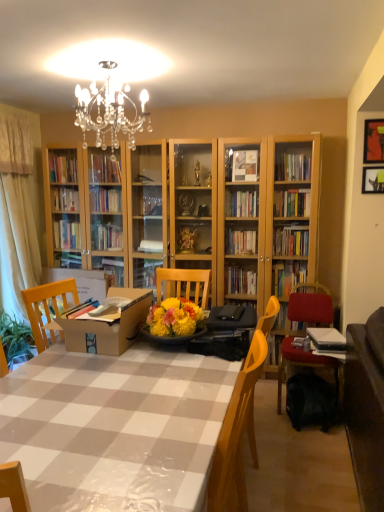
Identify the location of white glossy table at center. This screenshot has height=512, width=384. (115, 426).

In order to face black fabric backpack at lower right, should I rotate leftwards or rightwards?

To face it directly, rotate right by 15.805 degrees.

The image size is (384, 512). I want to click on beige fabric curtain at left, so click(x=17, y=216).

From the image's perspective, between white glossy table at center and brown cardboard box at center, who is located below?

From the image's view, white glossy table at center is below.

Looking at their sizes, would you say white glossy table at center is wider or thinner than brown cardboard box at center?

In the image, white glossy table at center appears to be wider than brown cardboard box at center.

From their relative heights in the image, would you say white glossy table at center is taller or shorter than brown cardboard box at center?

white glossy table at center is taller than brown cardboard box at center.

Are white glossy table at center and brown cardboard box at center far apart?

They are positioned close to each other.

Which of these two, velvet red chair at right or metallic silver picture frame at upper right, placed as the second picture frame when sorted from top to bottom, stands shorter?

metallic silver picture frame at upper right, placed as the second picture frame when sorted from top to bottom, is shorter.

Considering the sizes of velvet red chair at right and metallic silver picture frame at upper right, which ranks as the 1th picture frame in bottom-to-top order, in the image, is velvet red chair at right bigger or smaller than metallic silver picture frame at upper right, which ranks as the 1th picture frame in bottom-to-top order,?

In the image, velvet red chair at right appears to be larger than metallic silver picture frame at upper right, which ranks as the 1th picture frame in bottom-to-top order.

Would you say velvet red chair at right is to the left or to the right of metallic silver picture frame at upper right, placed as the second picture frame when sorted from top to bottom, in the picture?

Based on their positions, velvet red chair at right is located to the left of metallic silver picture frame at upper right, placed as the second picture frame when sorted from top to bottom.

From a real-world perspective, is velvet red chair at right located higher than metallic silver picture frame at upper right, placed as the second picture frame when sorted from top to bottom?

Actually, velvet red chair at right is physically below metallic silver picture frame at upper right, placed as the second picture frame when sorted from top to bottom, in the real world.

How many degrees apart are the facing directions of brown cardboard box at center and metallic silver picture frame at upper right, placed as the second picture frame when sorted from top to bottom?

They differ by 1.79 degrees in their facing directions.

There is a brown cardboard box at center. At what (x,y) coordinates should I click in order to perform the action: click on the 1st picture frame above it (from the image's perspective). Please return your answer as a coordinate pair (x, y). Looking at the image, I should click on (373, 180).

Is point (104, 353) closer to camera compared to point (370, 169)?

Yes, point (104, 353) is in front of point (370, 169).

Consider the image. Does brown cardboard box at center touch metallic gold picture frame at upper right, the 1th picture frame viewed from the top?

No, brown cardboard box at center is not next to metallic gold picture frame at upper right, the 1th picture frame viewed from the top.

Based on the photo, does brown cardboard box at center lie in front of metallic gold picture frame at upper right, which is counted as the second picture frame, starting from the bottom?

Yes, the depth of brown cardboard box at center is less than that of metallic gold picture frame at upper right, which is counted as the second picture frame, starting from the bottom.

Would you say brown cardboard box at center is to the left or to the right of metallic gold picture frame at upper right, the 1th picture frame viewed from the top, in the picture?

Based on their positions, brown cardboard box at center is located to the left of metallic gold picture frame at upper right, the 1th picture frame viewed from the top.

Does metallic silver picture frame at upper right, placed as the second picture frame when sorted from top to bottom, have a greater width compared to metallic gold picture frame at upper right, which is counted as the second picture frame, starting from the bottom?

No, metallic silver picture frame at upper right, placed as the second picture frame when sorted from top to bottom, is not wider than metallic gold picture frame at upper right, which is counted as the second picture frame, starting from the bottom.

Looking at the image, does metallic silver picture frame at upper right, placed as the second picture frame when sorted from top to bottom, seem bigger or smaller compared to metallic gold picture frame at upper right, which is counted as the second picture frame, starting from the bottom?

metallic silver picture frame at upper right, placed as the second picture frame when sorted from top to bottom, is smaller than metallic gold picture frame at upper right, which is counted as the second picture frame, starting from the bottom.

Can you tell me how much metallic silver picture frame at upper right, which ranks as the 1th picture frame in bottom-to-top order, and metallic gold picture frame at upper right, the 1th picture frame viewed from the top, differ in facing direction?

The angular difference between metallic silver picture frame at upper right, which ranks as the 1th picture frame in bottom-to-top order, and metallic gold picture frame at upper right, the 1th picture frame viewed from the top, is 0.0364 degrees.

Which is more to the right, metallic silver picture frame at upper right, placed as the second picture frame when sorted from top to bottom, or metallic gold picture frame at upper right, which is counted as the second picture frame, starting from the bottom?

metallic silver picture frame at upper right, placed as the second picture frame when sorted from top to bottom, is more to the right.

From a real-world perspective, is metallic gold picture frame at upper right, the 1th picture frame viewed from the top, above or below white glossy table at center?

metallic gold picture frame at upper right, the 1th picture frame viewed from the top, is situated higher than white glossy table at center in the real world.

Is point (366, 123) closer to viewer compared to point (186, 483)?

No, it is behind (186, 483).

Considering the relative sizes of metallic gold picture frame at upper right, the 1th picture frame viewed from the top, and white glossy table at center in the image provided, is metallic gold picture frame at upper right, the 1th picture frame viewed from the top, bigger than white glossy table at center?

No, metallic gold picture frame at upper right, the 1th picture frame viewed from the top, is not bigger than white glossy table at center.

Does metallic gold picture frame at upper right, the 1th picture frame viewed from the top, appear on the right side of white glossy table at center?

Indeed, metallic gold picture frame at upper right, the 1th picture frame viewed from the top, is positioned on the right side of white glossy table at center.

Considering the sizes of objects metallic silver picture frame at upper right, which ranks as the 1th picture frame in bottom-to-top order, and beige fabric curtain at left in the image provided, who is thinner, metallic silver picture frame at upper right, which ranks as the 1th picture frame in bottom-to-top order, or beige fabric curtain at left?

With smaller width is metallic silver picture frame at upper right, which ranks as the 1th picture frame in bottom-to-top order.

Which object is more forward, metallic silver picture frame at upper right, which ranks as the 1th picture frame in bottom-to-top order, or beige fabric curtain at left?

metallic silver picture frame at upper right, which ranks as the 1th picture frame in bottom-to-top order, is in front.

Find the location of a particular element. The image size is (384, 512). curtain behind the metallic silver picture frame at upper right, placed as the second picture frame when sorted from top to bottom is located at coordinates (17, 216).

Which is in front, point (364, 170) or point (24, 164)?

The point (364, 170) is closer to the camera.

Identify the location of desk lying in front of the brown cardboard box at center. The image size is (384, 512). pos(115,426).

This screenshot has height=512, width=384. Identify the location of picture frame that is the 1st object above the velvet red chair at right (from a real-world perspective). (373, 180).

When comparing their distances from velvet red chair at right, does metallic silver picture frame at upper right, placed as the second picture frame when sorted from top to bottom, or white glossy table at center seem further?

white glossy table at center lies further to velvet red chair at right than the other object.

In the scene shown: Estimate the real-world distances between objects in this image. Which object is closer to beige fabric curtain at left, black fabric backpack at lower right or metallic gold picture frame at upper right, the 1th picture frame viewed from the top?

Among the two, black fabric backpack at lower right is located nearer to beige fabric curtain at left.

When comparing their distances from white glossy table at center, does beige fabric curtain at left or metallic silver picture frame at upper right, which ranks as the 1th picture frame in bottom-to-top order, seem further?

beige fabric curtain at left.

Based on their spatial positions, is brown cardboard box at center or metallic silver picture frame at upper right, placed as the second picture frame when sorted from top to bottom, further from velvet red chair at right?

brown cardboard box at center is further to velvet red chair at right.

In the scene shown: Based on their spatial positions, is beige fabric curtain at left or velvet red chair at right closer to brown cardboard box at center?

velvet red chair at right is positioned closer to the anchor brown cardboard box at center.

From the image, which object appears to be nearer to brown cardboard box at center, white glossy table at center or metallic silver picture frame at upper right, which ranks as the 1th picture frame in bottom-to-top order?

white glossy table at center.

Estimate the real-world distances between objects in this image. Which object is further from metallic gold picture frame at upper right, which is counted as the second picture frame, starting from the bottom, velvet red chair at right or metallic silver picture frame at upper right, placed as the second picture frame when sorted from top to bottom?

Based on the image, velvet red chair at right appears to be further to metallic gold picture frame at upper right, which is counted as the second picture frame, starting from the bottom.

Which object lies nearer to the anchor point velvet red chair at right, brown cardboard box at center or white glossy table at center?

brown cardboard box at center.

You are a GUI agent. You are given a task and a screenshot of the screen. Output one action in this format:
    pyautogui.click(x=<x>, y=<y>)
    Task: Click on the cardboard box located between beige fabric curtain at left and black fabric backpack at lower right in the left-right direction
    The width and height of the screenshot is (384, 512).
    Given the screenshot: What is the action you would take?
    pyautogui.click(x=109, y=326)

Where is `chair located between white glossy table at center and metallic silver picture frame at upper right, which ranks as the 1th picture frame in bottom-to-top order, in the depth direction`? This screenshot has height=512, width=384. chair located between white glossy table at center and metallic silver picture frame at upper right, which ranks as the 1th picture frame in bottom-to-top order, in the depth direction is located at coordinates (303, 334).

The image size is (384, 512). In order to click on desk situated between brown cardboard box at center and metallic gold picture frame at upper right, the 1th picture frame viewed from the top, from left to right in this screenshot , I will do `click(115, 426)`.

Image resolution: width=384 pixels, height=512 pixels. I want to click on backpack between white glossy table at center and beige fabric curtain at left from front to back, so click(x=311, y=401).